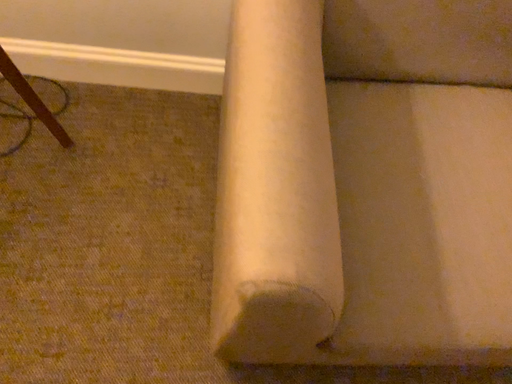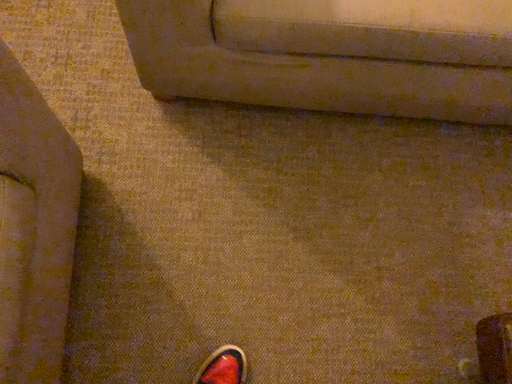
Question: How did the camera likely rotate when shooting the video?

Choices:
 (A) rotated upward
 (B) rotated downward

Answer: (B)